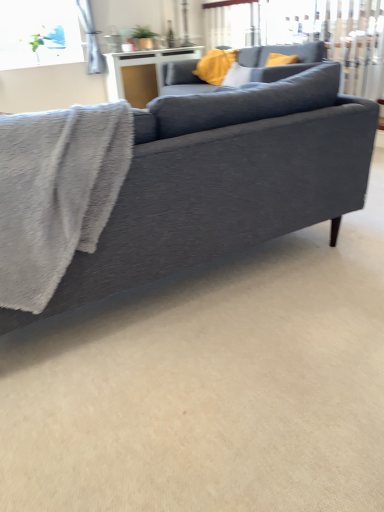
Question: Is matte gray couch at upper center, which ranks as the 2th studio couch in front-to-back order, in front of or behind gray fuzzy bath towel at left in the image?

Choices:
 (A) behind
 (B) front

Answer: (A)

Question: Considering the relative positions of matte gray couch at upper center, the second studio couch in the bottom-to-top sequence, and gray fuzzy bath towel at left in the image provided, is matte gray couch at upper center, the second studio couch in the bottom-to-top sequence, to the left or to the right of gray fuzzy bath towel at left?

Choices:
 (A) left
 (B) right

Answer: (B)

Question: Which object is the closest to the gray fuzzy bath towel at left?

Choices:
 (A) matte gray couch at upper center, which ranks as the 2th studio couch in front-to-back order
 (B) matte gray couch at center, which ranks as the 1th studio couch in bottom-to-top order
 (C) white glossy table at upper center
 (D) yellow fabric pillow at upper center

Answer: (B)

Question: Estimate the real-world distances between objects in this image. Which object is closer to the matte gray couch at upper center, which ranks as the 2th studio couch in front-to-back order?

Choices:
 (A) matte gray couch at center, which ranks as the 1th studio couch in bottom-to-top order
 (B) gray fuzzy bath towel at left
 (C) yellow fabric pillow at upper center
 (D) white glossy table at upper center

Answer: (C)